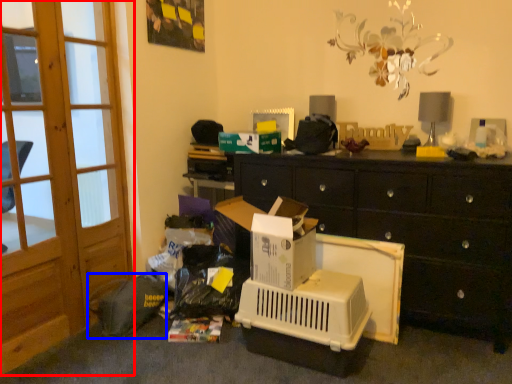
Question: Which of the following is the farthest to the observer, screen door (highlighted by a red box) or garbage (highlighted by a blue box)?

Choices:
 (A) screen door
 (B) garbage

Answer: (B)